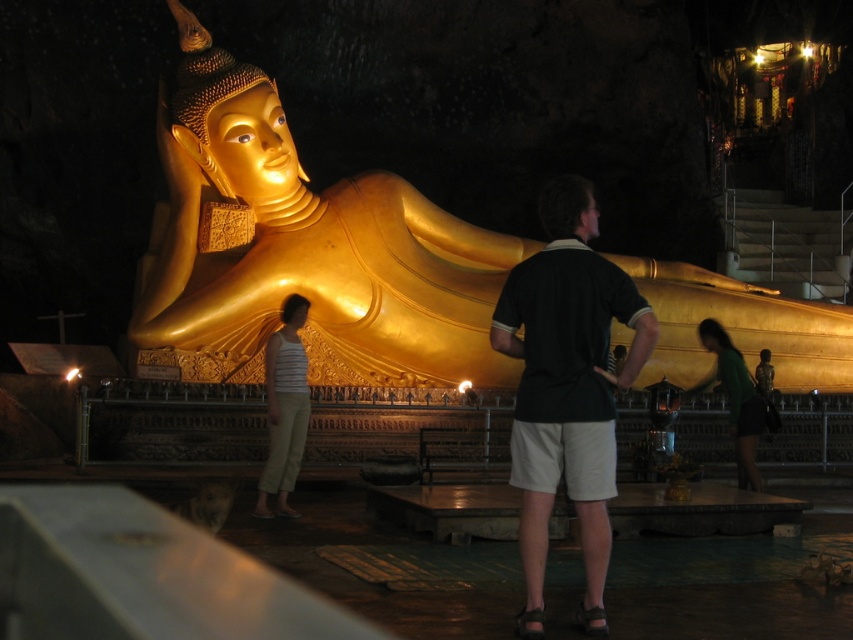
You are a photographer trying to capture a clear shot of the gold polished statue at center and the striped tank top at center. Based on their positions, which object is positioned to the right side of the other?

The gold polished statue at center is positioned to the right of striped tank top at center according to the description.

You are a photographer planning to take a group photo of the people wearing the black cotton polo shirt at center and the striped tank top at center. Which person should stand at the back to avoid blocking the statue?

The black cotton polo shirt at center is taller than the striped tank top at center, so the person wearing the black cotton polo shirt at center should stand at the back to avoid blocking the statue.